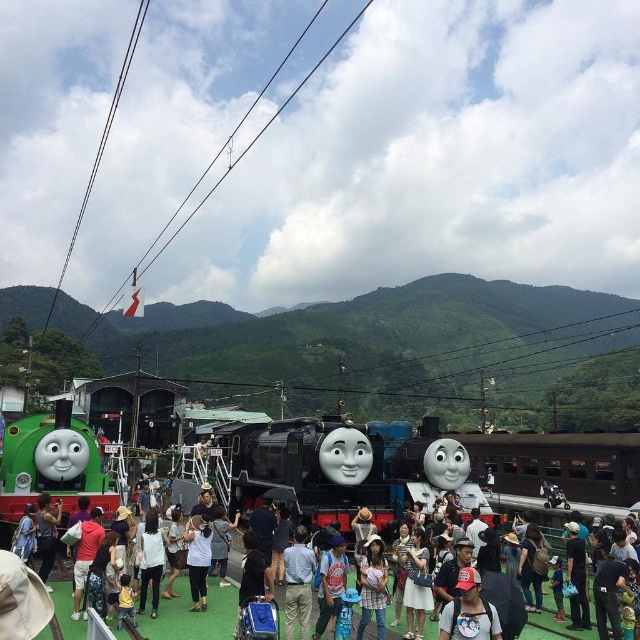
Who is more forward, (184,586) or (472,627)?

Point (472,627) is more forward.

Where is `matte black train at center`? The image size is (640, 640). matte black train at center is located at coordinates (193, 616).

Does white cotton cap at center have a larger size compared to white cotton shirt at center?

No.

I want to click on white cotton cap at center, so click(468, 611).

Can you confirm if matte black train at center is positioned below white cotton shirt at center?

Yes, matte black train at center is below white cotton shirt at center.

Is matte black train at center above white cotton shirt at center?

No, matte black train at center is not above white cotton shirt at center.

Does point (186, 593) come behind point (208, 532)?

No, (186, 593) is in front of (208, 532).

The image size is (640, 640). What are the coordinates of `matte black train at center` in the screenshot? It's located at (193, 616).